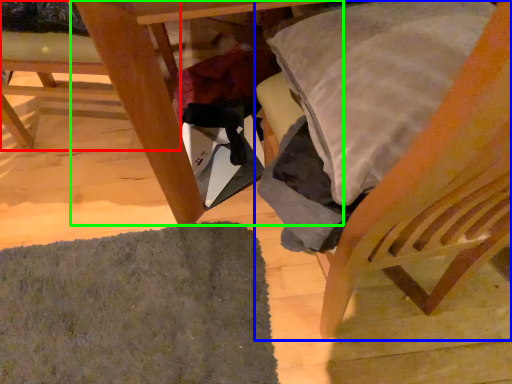
Question: Based on their relative distances, which object is nearer to chair (highlighted by a red box)? Choose from chair (highlighted by a blue box) and table (highlighted by a green box).

Choices:
 (A) chair
 (B) table

Answer: (B)